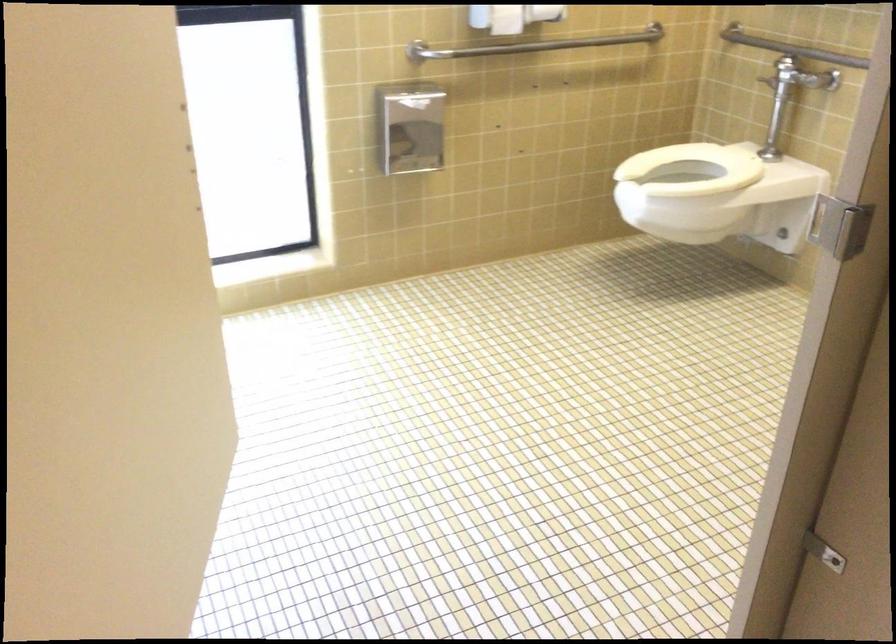
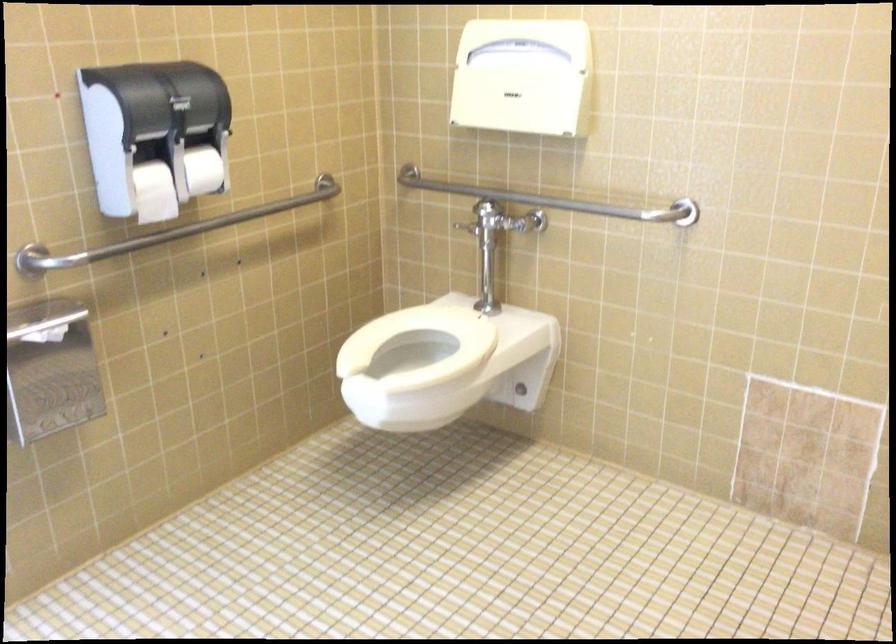
Question: In a continuous first-person perspective shot, in which direction is the camera moving?

Choices:
 (A) Left
 (B) Right
 (C) Forward
 (D) Backward

Answer: (C)